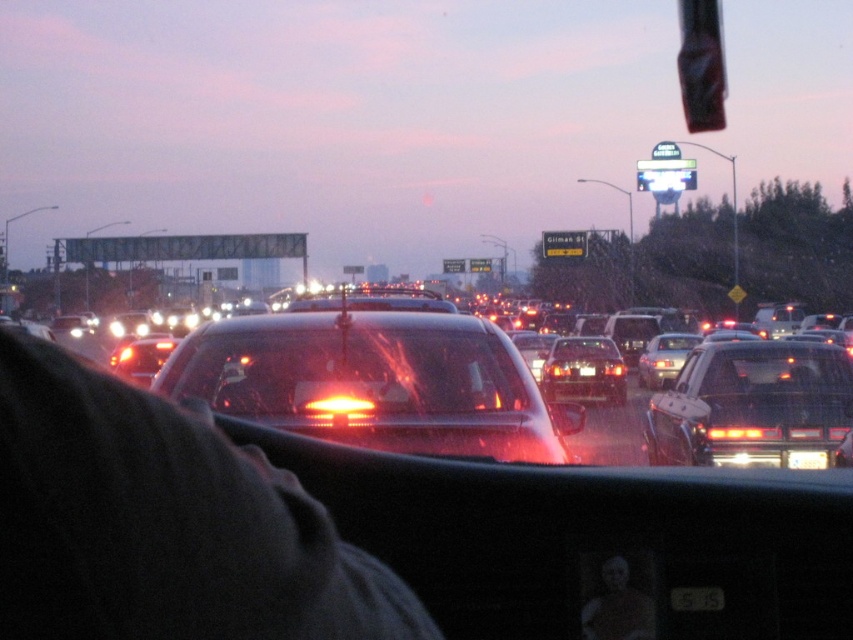
Question: Does transparent glass windshield at center have a greater width compared to matte black suv at right?

Choices:
 (A) yes
 (B) no

Answer: (B)

Question: Which object is the farthest from the black plastic traffic light at upper right?

Choices:
 (A) black plastic license plate at center
 (B) glossy black sedan at center

Answer: (A)

Question: Which point is farther to the camera?

Choices:
 (A) (688, 0)
 (B) (444, 360)

Answer: (A)

Question: Does glossy black sedan at center have a larger size compared to black plastic license plate at center?

Choices:
 (A) no
 (B) yes

Answer: (B)

Question: Among these objects, which one is nearest to the camera?

Choices:
 (A) black plastic license plate at center
 (B) transparent glass windshield at center
 (C) black plastic traffic light at upper right

Answer: (A)

Question: Does glossy black sedan at center appear on the left side of black plastic traffic light at upper right?

Choices:
 (A) yes
 (B) no

Answer: (A)